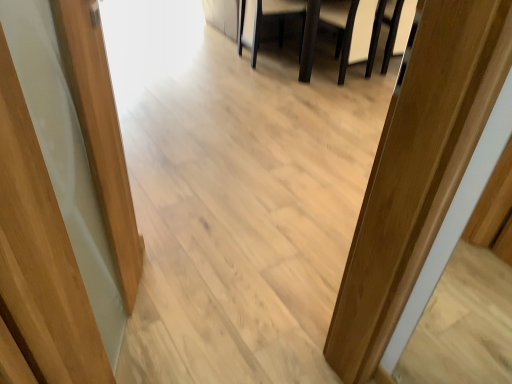
Identify the location of white leather armchair at upper center, which ranks as the second armchair in left-to-right order. (354, 31).

Measure the distance between dark brown wooden table at center and camera.

dark brown wooden table at center is 2.93 meters from camera.

The height and width of the screenshot is (384, 512). What are the coordinates of `white leather armchair at upper center, marked as the first armchair in a right-to-left arrangement` in the screenshot? It's located at (354, 31).

Considering the sizes of objects dark brown wooden table at center and white leather armchair at upper center, marked as the first armchair in a right-to-left arrangement, in the image provided, who is shorter, dark brown wooden table at center or white leather armchair at upper center, marked as the first armchair in a right-to-left arrangement,?

dark brown wooden table at center.

Does dark brown wooden table at center touch white leather armchair at upper center, marked as the first armchair in a right-to-left arrangement?

Yes, dark brown wooden table at center is touching white leather armchair at upper center, marked as the first armchair in a right-to-left arrangement.

Does point (263, 8) come farther from viewer compared to point (322, 10)?

No, it is in front of (322, 10).

Considering the relative positions of dark brown wooden table at center and white leather armchair at upper center, marked as the first armchair in a right-to-left arrangement, in the image provided, is dark brown wooden table at center to the left of white leather armchair at upper center, marked as the first armchair in a right-to-left arrangement, from the viewer's perspective?

Correct, you'll find dark brown wooden table at center to the left of white leather armchair at upper center, marked as the first armchair in a right-to-left arrangement.

Is dark brown wooden table at center in front of or behind dark brown leather armchair at center, the first armchair in the left-to-right sequence, in the image?

Visually, dark brown wooden table at center is located in front of dark brown leather armchair at center, the first armchair in the left-to-right sequence.

Considering the sizes of objects dark brown wooden table at center and dark brown leather armchair at center, the first armchair in the left-to-right sequence, in the image provided, who is smaller, dark brown wooden table at center or dark brown leather armchair at center, the first armchair in the left-to-right sequence,?

Smaller between the two is dark brown leather armchair at center, the first armchair in the left-to-right sequence.

Is dark brown wooden table at center at the right side of dark brown leather armchair at center, placed as the second armchair when sorted from right to left?

Indeed, dark brown wooden table at center is positioned on the right side of dark brown leather armchair at center, placed as the second armchair when sorted from right to left.

Between white leather armchair at upper center, which ranks as the second armchair in left-to-right order, and dark brown leather armchair at center, placed as the second armchair when sorted from right to left, which one appears on the right side from the viewer's perspective?

Positioned to the right is white leather armchair at upper center, which ranks as the second armchair in left-to-right order.

Is white leather armchair at upper center, which ranks as the second armchair in left-to-right order, bigger than dark brown leather armchair at center, placed as the second armchair when sorted from right to left?

Correct, white leather armchair at upper center, which ranks as the second armchair in left-to-right order, is larger in size than dark brown leather armchair at center, placed as the second armchair when sorted from right to left.

Can you confirm if white leather armchair at upper center, which ranks as the second armchair in left-to-right order, is thinner than dark brown leather armchair at center, placed as the second armchair when sorted from right to left?

In fact, white leather armchair at upper center, which ranks as the second armchair in left-to-right order, might be wider than dark brown leather armchair at center, placed as the second armchair when sorted from right to left.

Is white leather armchair at upper center, marked as the first armchair in a right-to-left arrangement, far from dark brown leather armchair at center, placed as the second armchair when sorted from right to left?

No, white leather armchair at upper center, marked as the first armchair in a right-to-left arrangement, is in close proximity to dark brown leather armchair at center, placed as the second armchair when sorted from right to left.

At what (x,y) coordinates should I click in order to perform the action: click on furniture positioned vertically above the dark brown leather armchair at center, placed as the second armchair when sorted from right to left (from a real-world perspective). Please return your answer as a coordinate pair (x, y). Looking at the image, I should click on (330, 26).

Between dark brown leather armchair at center, placed as the second armchair when sorted from right to left, and dark brown wooden table at center, which one has smaller size?

Smaller between the two is dark brown leather armchair at center, placed as the second armchair when sorted from right to left.

Is dark brown wooden table at center completely or partially inside dark brown leather armchair at center, the first armchair in the left-to-right sequence?

No, dark brown wooden table at center is not a part of dark brown leather armchair at center, the first armchair in the left-to-right sequence.

Is dark brown leather armchair at center, the first armchair in the left-to-right sequence, positioned in front of dark brown wooden table at center?

That is False.

Who is bigger, white leather armchair at upper center, marked as the first armchair in a right-to-left arrangement, or dark brown wooden table at center?

Bigger between the two is dark brown wooden table at center.

Does white leather armchair at upper center, which ranks as the second armchair in left-to-right order, have a lesser height compared to dark brown wooden table at center?

No.

Based on the photo, from the image's perspective, who appears lower, white leather armchair at upper center, marked as the first armchair in a right-to-left arrangement, or dark brown wooden table at center?

white leather armchair at upper center, marked as the first armchair in a right-to-left arrangement, appears lower in the image.

Looking at this image, from a real-world perspective, is white leather armchair at upper center, which ranks as the second armchair in left-to-right order, beneath dark brown wooden table at center?

Incorrect, from a real-world perspective, white leather armchair at upper center, which ranks as the second armchair in left-to-right order, is higher than dark brown wooden table at center.

How many degrees apart are the facing directions of dark brown leather armchair at center, placed as the second armchair when sorted from right to left, and white leather armchair at upper center, which ranks as the second armchair in left-to-right order?

dark brown leather armchair at center, placed as the second armchair when sorted from right to left, and white leather armchair at upper center, which ranks as the second armchair in left-to-right order, are facing 98.7 degrees away from each other.

Consider the image. Considering the sizes of objects dark brown leather armchair at center, the first armchair in the left-to-right sequence, and white leather armchair at upper center, marked as the first armchair in a right-to-left arrangement, in the image provided, who is bigger, dark brown leather armchair at center, the first armchair in the left-to-right sequence, or white leather armchair at upper center, marked as the first armchair in a right-to-left arrangement,?

white leather armchair at upper center, marked as the first armchair in a right-to-left arrangement, is bigger.

Is dark brown leather armchair at center, the first armchair in the left-to-right sequence, turned away from white leather armchair at upper center, marked as the first armchair in a right-to-left arrangement?

No, dark brown leather armchair at center, the first armchair in the left-to-right sequence,'s orientation is not away from white leather armchair at upper center, marked as the first armchair in a right-to-left arrangement.

Does point (303, 2) lie behind point (322, 16)?

No, it is in front of (322, 16).

At what (x,y) coordinates should I click in order to perform the action: click on armchair that is above the dark brown wooden table at center (from a real-world perspective). Please return your answer as a coordinate pair (x, y). This screenshot has height=384, width=512. Looking at the image, I should click on (354, 31).

At what (x,y) coordinates should I click in order to perform the action: click on furniture located in front of the dark brown leather armchair at center, the first armchair in the left-to-right sequence. Please return your answer as a coordinate pair (x, y). Looking at the image, I should click on (330, 26).

Which object lies nearer to the anchor point white leather armchair at upper center, which ranks as the second armchair in left-to-right order, dark brown wooden table at center or dark brown leather armchair at center, the first armchair in the left-to-right sequence?

dark brown wooden table at center is closer to white leather armchair at upper center, which ranks as the second armchair in left-to-right order.

Based on the photo, considering their positions, is dark brown leather armchair at center, the first armchair in the left-to-right sequence, positioned further to dark brown wooden table at center than white leather armchair at upper center, which ranks as the second armchair in left-to-right order?

Among the two, dark brown leather armchair at center, the first armchair in the left-to-right sequence, is located further to dark brown wooden table at center.

Estimate the real-world distances between objects in this image. Which object is further from dark brown wooden table at center, white leather armchair at upper center, which ranks as the second armchair in left-to-right order, or dark brown leather armchair at center, the first armchair in the left-to-right sequence?

Based on the image, dark brown leather armchair at center, the first armchair in the left-to-right sequence, appears to be further to dark brown wooden table at center.

When comparing their distances from dark brown leather armchair at center, the first armchair in the left-to-right sequence, does dark brown wooden table at center or white leather armchair at upper center, which ranks as the second armchair in left-to-right order, seem closer?

white leather armchair at upper center, which ranks as the second armchair in left-to-right order, is positioned closer to the anchor dark brown leather armchair at center, the first armchair in the left-to-right sequence.

Looking at the image, which one is located further to white leather armchair at upper center, which ranks as the second armchair in left-to-right order, dark brown leather armchair at center, placed as the second armchair when sorted from right to left, or dark brown wooden table at center?

The object further to white leather armchair at upper center, which ranks as the second armchair in left-to-right order, is dark brown leather armchair at center, placed as the second armchair when sorted from right to left.

When comparing their distances from dark brown leather armchair at center, placed as the second armchair when sorted from right to left, does white leather armchair at upper center, which ranks as the second armchair in left-to-right order, or dark brown wooden table at center seem further?

dark brown wooden table at center.

Find the location of a particular element. Image resolution: width=512 pixels, height=384 pixels. furniture situated between dark brown leather armchair at center, the first armchair in the left-to-right sequence, and white leather armchair at upper center, marked as the first armchair in a right-to-left arrangement, from left to right is located at coordinates (330, 26).